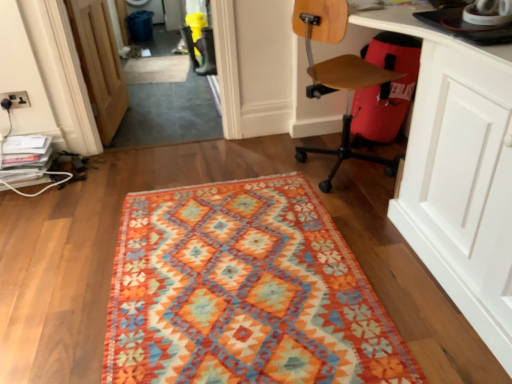
Question: Is matte black electric outlet at upper left facing away from white glossy computer desk at lower right?

Choices:
 (A) no
 (B) yes

Answer: (A)

Question: Is matte black electric outlet at upper left located outside white glossy computer desk at lower right?

Choices:
 (A) no
 (B) yes

Answer: (B)

Question: Is matte black electric outlet at upper left with white glossy computer desk at lower right?

Choices:
 (A) no
 (B) yes

Answer: (A)

Question: Is white glossy computer desk at lower right completely or partially inside matte black electric outlet at upper left?

Choices:
 (A) yes
 (B) no

Answer: (B)

Question: From the image's perspective, is matte black electric outlet at upper left over white glossy computer desk at lower right?

Choices:
 (A) no
 (B) yes

Answer: (B)

Question: Considering the relative positions of matte black electric outlet at upper left and white glossy computer desk at lower right in the image provided, is matte black electric outlet at upper left to the left of white glossy computer desk at lower right from the viewer's perspective?

Choices:
 (A) yes
 (B) no

Answer: (A)

Question: From a real-world perspective, is wooden at right physically below white glossy computer desk at lower right?

Choices:
 (A) yes
 (B) no

Answer: (A)

Question: Does wooden at right have a larger size compared to white glossy computer desk at lower right?

Choices:
 (A) yes
 (B) no

Answer: (B)

Question: Can you confirm if wooden at right is positioned to the right of white glossy computer desk at lower right?

Choices:
 (A) yes
 (B) no

Answer: (B)

Question: Considering the relative positions of wooden at right and white glossy computer desk at lower right in the image provided, is wooden at right to the left of white glossy computer desk at lower right from the viewer's perspective?

Choices:
 (A) no
 (B) yes

Answer: (B)

Question: Is white glossy computer desk at lower right inside wooden at right?

Choices:
 (A) yes
 (B) no

Answer: (B)

Question: Are wooden at right and white glossy computer desk at lower right located far from each other?

Choices:
 (A) no
 (B) yes

Answer: (A)

Question: Is white glossy computer desk at lower right positioned in front of textured woolen rug at center?

Choices:
 (A) yes
 (B) no

Answer: (A)